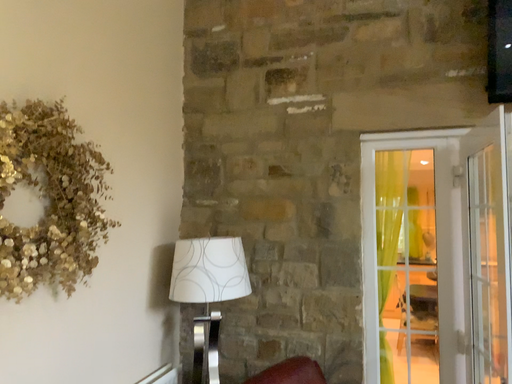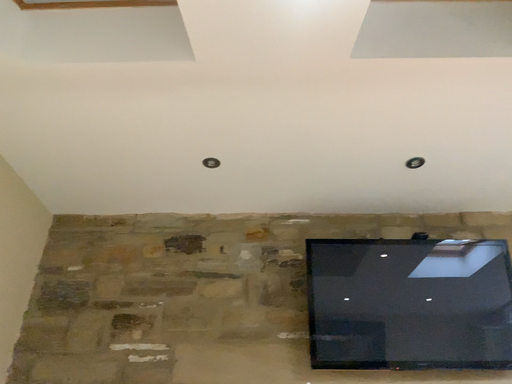
Question: How did the camera likely rotate when shooting the video?

Choices:
 (A) rotated downward
 (B) rotated upward

Answer: (B)